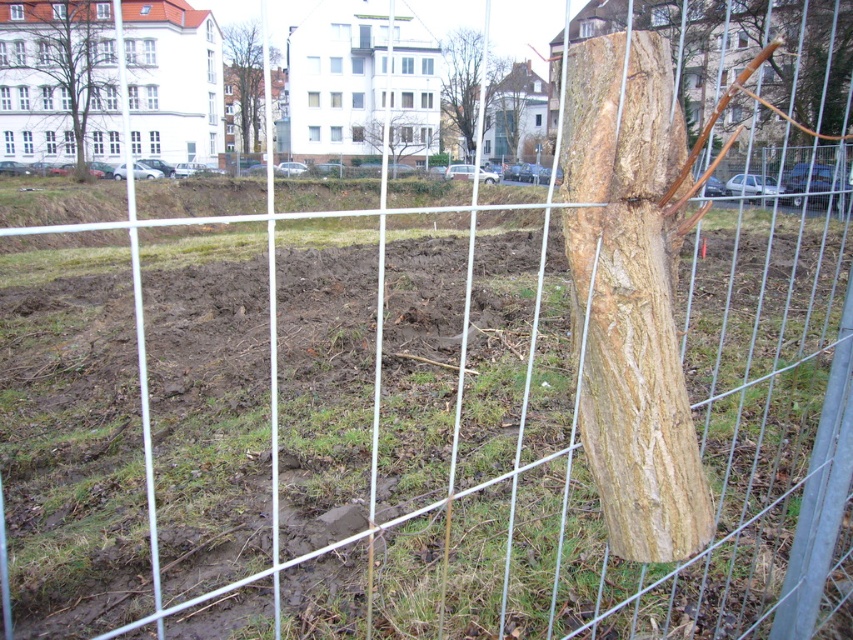
Question: Which of the following is the closest to the observer?

Choices:
 (A) (479, 65)
 (B) (99, 45)
 (C) (231, 72)
 (D) (426, 125)

Answer: (B)

Question: Does light brown wood at upper right have a smaller size compared to brown textured tree trunk at upper center?

Choices:
 (A) yes
 (B) no

Answer: (B)

Question: Can you confirm if light brown wood at center is bigger than brown rough tree at upper left?

Choices:
 (A) no
 (B) yes

Answer: (A)

Question: Which object is farther from the camera taking this photo?

Choices:
 (A) brown textured tree trunk at upper center
 (B) smooth brown tree trunk at center

Answer: (A)

Question: Among these points, which one is nearest to the camera?

Choices:
 (A) (228, 145)
 (B) (646, 115)
 (C) (807, 12)
 (D) (445, 81)

Answer: (B)

Question: Can you confirm if light brown wood at center is thinner than smooth brown tree trunk at center?

Choices:
 (A) no
 (B) yes

Answer: (B)